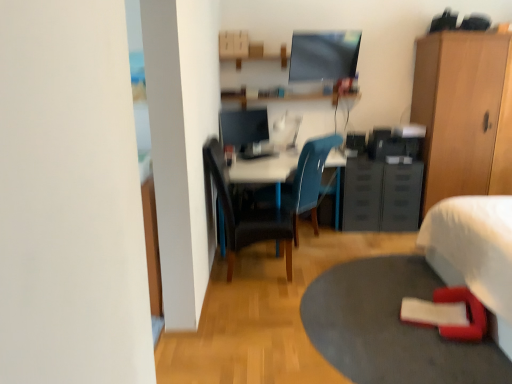
Identify the location of rubberized red mat at lower right. (391, 327).

In order to face rubberized red mat at lower right, should I rotate leftwards or rightwards?

Rotate right and turn 18.040 degrees.

The width and height of the screenshot is (512, 384). Describe the element at coordinates (475, 254) in the screenshot. I see `white fabric bed at lower right` at that location.

What do you see at coordinates (464, 113) in the screenshot? The height and width of the screenshot is (384, 512). I see `wooden cabinet at right` at bounding box center [464, 113].

The height and width of the screenshot is (384, 512). What do you see at coordinates (244, 126) in the screenshot? I see `satin black monitor at center` at bounding box center [244, 126].

Locate an element on the screen. The height and width of the screenshot is (384, 512). rubberized red mat at lower right is located at coordinates (391, 327).

Is white fabric bed at lower right looking in the opposite direction of black plastic file cabinet at center-right?

No.

Which is behind, point (489, 252) or point (395, 226)?

The point (395, 226) is farther from the camera.

Can you tell me how much white fabric bed at lower right and black plastic file cabinet at center-right differ in facing direction?

There is a 88.6-degree angle between the facing directions of white fabric bed at lower right and black plastic file cabinet at center-right.

Is white fabric bed at lower right outside of black plastic file cabinet at center-right?

Yes.

Which object is positioned more to the right, black plastic drawer at center-right or wooden cabinet at right?

wooden cabinet at right is more to the right.

Considering the points (367, 206) and (484, 98), which point is in front, point (367, 206) or point (484, 98)?

The point (484, 98) is closer.

Identify the location of drawer below the wooden cabinet at right (from a real-world perspective). This screenshot has width=512, height=384. (362, 194).

In the scene shown: From the image's perspective, is white fabric bed at lower right located beneath black leather chair at center, which appears as the 2th chair when viewed from the back?

Yes, from the image's perspective, white fabric bed at lower right is beneath black leather chair at center, which appears as the 2th chair when viewed from the back.

In the scene shown: Considering the positions of objects white fabric bed at lower right and black leather chair at center, placed as the first chair when sorted from front to back, in the image provided, who is behind, white fabric bed at lower right or black leather chair at center, placed as the first chair when sorted from front to back,?

black leather chair at center, placed as the first chair when sorted from front to back.

From a real-world perspective, is white fabric bed at lower right positioned above or below black leather chair at center, which appears as the 2th chair when viewed from the back?

white fabric bed at lower right is situated lower than black leather chair at center, which appears as the 2th chair when viewed from the back, in the real world.

In terms of width, does white fabric bed at lower right look wider or thinner when compared to black leather chair at center, placed as the first chair when sorted from front to back?

Clearly, white fabric bed at lower right has more width compared to black leather chair at center, placed as the first chair when sorted from front to back.

From a real-world perspective, is white fabric bed at lower right positioned above or below matte blue chair at center, which ranks as the second chair in front-to-back order?

white fabric bed at lower right is situated lower than matte blue chair at center, which ranks as the second chair in front-to-back order, in the real world.

Can you confirm if white fabric bed at lower right is shorter than matte blue chair at center, which is the first chair from back to front?

Yes, white fabric bed at lower right is shorter than matte blue chair at center, which is the first chair from back to front.

From the image's perspective, is white fabric bed at lower right on matte blue chair at center, which is the first chair from back to front?

No.

Is white fabric bed at lower right inside the boundaries of matte blue chair at center, which ranks as the second chair in front-to-back order, or outside?

white fabric bed at lower right is located beyond the bounds of matte blue chair at center, which ranks as the second chair in front-to-back order.

I want to click on chair that is the 2nd object directly below the satin black monitor at center (from a real-world perspective), so click(307, 181).

Which point is more forward, [276,196] or [230,122]?

The point [276,196] is more forward.

Is matte blue chair at center, which ranks as the second chair in front-to-back order, looking in the opposite direction of satin black monitor at center?

matte blue chair at center, which ranks as the second chair in front-to-back order, does not have its back to satin black monitor at center.

From a real-world perspective, relative to satin black monitor at center, is matte blue chair at center, which is the first chair from back to front, vertically above or below?

From a real-world perspective, matte blue chair at center, which is the first chair from back to front, is physically below satin black monitor at center.

Find the location of a particular element. This screenshot has width=512, height=384. bed that is on the right side of black plastic drawer at center-right is located at coordinates (475, 254).

In terms of width, does white fabric bed at lower right look wider or thinner when compared to black plastic drawer at center-right?

Considering their sizes, white fabric bed at lower right looks broader than black plastic drawer at center-right.

Considering the positions of objects white fabric bed at lower right and black plastic drawer at center-right in the image provided, who is in front, white fabric bed at lower right or black plastic drawer at center-right?

white fabric bed at lower right is more forward.

Based on the photo, considering the relative sizes of white fabric bed at lower right and black plastic drawer at center-right in the image provided, is white fabric bed at lower right smaller than black plastic drawer at center-right?

No, white fabric bed at lower right is not smaller than black plastic drawer at center-right.

Where is `cabinetry located above the white glossy computer desk at center (from a real-world perspective)`? This screenshot has height=384, width=512. cabinetry located above the white glossy computer desk at center (from a real-world perspective) is located at coordinates (464, 113).

Is wooden cabinet at right bigger or smaller than white glossy computer desk at center?

Clearly, wooden cabinet at right is larger in size than white glossy computer desk at center.

Between wooden cabinet at right and white glossy computer desk at center, which one has more height?

wooden cabinet at right is taller.

Would you say white glossy computer desk at center is part of wooden cabinet at right's contents?

No, white glossy computer desk at center is not surrounded by wooden cabinet at right.

Where is `file cabinet behind the white fabric bed at lower right`? file cabinet behind the white fabric bed at lower right is located at coordinates (381, 195).

Where is `cabinetry above the black plastic drawer at center-right (from the image's perspective)`? cabinetry above the black plastic drawer at center-right (from the image's perspective) is located at coordinates (464, 113).

When comparing their distances from matte blue chair at center, which ranks as the second chair in front-to-back order, does wooden cabinet at right or black plastic file cabinet at center-right seem closer?

The object closer to matte blue chair at center, which ranks as the second chair in front-to-back order, is black plastic file cabinet at center-right.

Which object lies further to the anchor point satin black monitor at center, white fabric bed at lower right or wooden cabinet at right?

white fabric bed at lower right is positioned further to the anchor satin black monitor at center.

Considering their positions, is matte blue chair at center, which ranks as the second chair in front-to-back order, positioned closer to black plastic file cabinet at center-right than black leather chair at center, which appears as the 2th chair when viewed from the back?

matte blue chair at center, which ranks as the second chair in front-to-back order, is positioned closer to the anchor black plastic file cabinet at center-right.

Based on their spatial positions, is matte blue chair at center, which is the first chair from back to front, or black plastic drawer at center-right further from black leather chair at center, placed as the first chair when sorted from front to back?

The object further to black leather chair at center, placed as the first chair when sorted from front to back, is black plastic drawer at center-right.

In the scene shown: When comparing their distances from rubberized red mat at lower right, does wooden cabinet at right or matte blue chair at center, which is the first chair from back to front, seem further?

wooden cabinet at right lies further to rubberized red mat at lower right than the other object.

Based on their spatial positions, is satin black monitor at center or white glossy computer desk at center further from black leather chair at center, which appears as the 2th chair when viewed from the back?

satin black monitor at center lies further to black leather chair at center, which appears as the 2th chair when viewed from the back, than the other object.

When comparing their distances from rubberized red mat at lower right, does wooden cabinet at right or satin black monitor at center seem closer?

Among the two, wooden cabinet at right is located nearer to rubberized red mat at lower right.

Considering their positions, is black leather chair at center, placed as the first chair when sorted from front to back, positioned further to white fabric bed at lower right than white glossy computer desk at center?

The object further to white fabric bed at lower right is black leather chair at center, placed as the first chair when sorted from front to back.

Find the location of a particular element. Image resolution: width=512 pixels, height=384 pixels. table between white fabric bed at lower right and matte blue chair at center, which is the first chair from back to front, from front to back is located at coordinates (391, 327).

Where is `computer desk situated between satin black monitor at center and black plastic drawer at center-right from left to right`? The width and height of the screenshot is (512, 384). computer desk situated between satin black monitor at center and black plastic drawer at center-right from left to right is located at coordinates (273, 196).

This screenshot has height=384, width=512. Identify the location of drawer between matte blue chair at center, which is the first chair from back to front, and wooden cabinet at right. point(362,194).

I want to click on computer desk situated between satin black monitor at center and wooden cabinet at right from left to right, so click(273, 196).